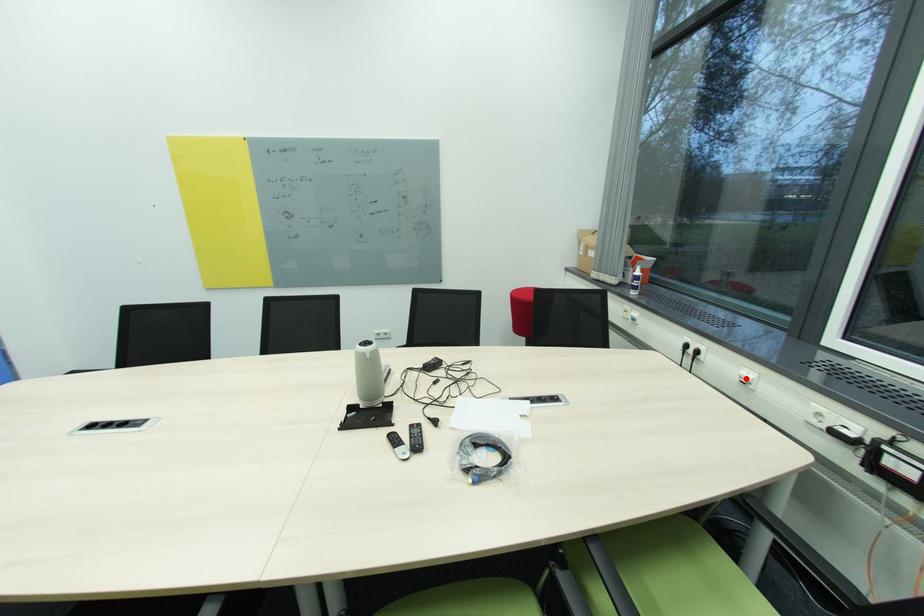
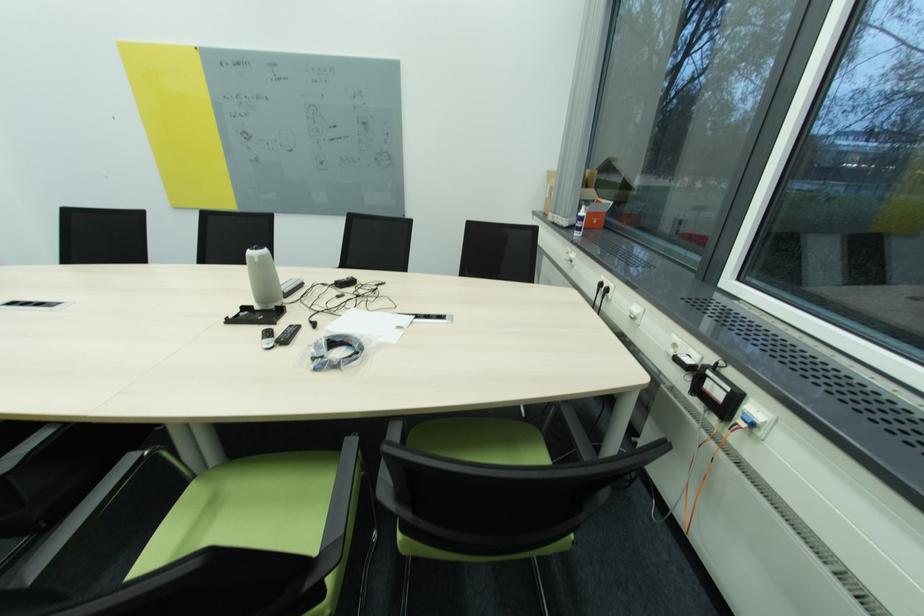
Where in the second image is the point corresponding to the highlighted location from the first image?

(636, 314)